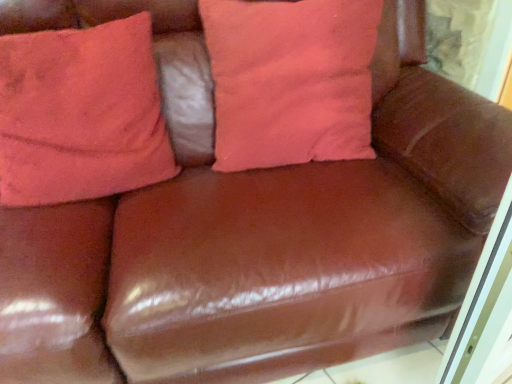
Question: Considering the relative positions of coral fabric pillow at upper left, which is the 1th pillow from left to right, and pink cotton pillow at center, arranged as the first pillow when viewed from the right, in the image provided, is coral fabric pillow at upper left, which is the 1th pillow from left to right, behind pink cotton pillow at center, arranged as the first pillow when viewed from the right,?

Choices:
 (A) no
 (B) yes

Answer: (A)

Question: From the image's perspective, is coral fabric pillow at upper left, marked as the 2th pillow in a right-to-left arrangement, over pink cotton pillow at center, arranged as the first pillow when viewed from the right?

Choices:
 (A) yes
 (B) no

Answer: (B)

Question: From the image's perspective, would you say coral fabric pillow at upper left, marked as the 2th pillow in a right-to-left arrangement, is shown under pink cotton pillow at center, arranged as the first pillow when viewed from the right?

Choices:
 (A) no
 (B) yes

Answer: (B)

Question: Is coral fabric pillow at upper left, which is the 1th pillow from left to right, turned away from pink cotton pillow at center, arranged as the first pillow when viewed from the right?

Choices:
 (A) yes
 (B) no

Answer: (B)

Question: Does coral fabric pillow at upper left, which is the 1th pillow from left to right, have a greater width compared to pink cotton pillow at center, arranged as the first pillow when viewed from the right?

Choices:
 (A) yes
 (B) no

Answer: (B)

Question: Considering the relative sizes of coral fabric pillow at upper left, which is the 1th pillow from left to right, and pink cotton pillow at center, the 2th pillow in the left-to-right sequence, in the image provided, is coral fabric pillow at upper left, which is the 1th pillow from left to right, thinner than pink cotton pillow at center, the 2th pillow in the left-to-right sequence,?

Choices:
 (A) no
 (B) yes

Answer: (B)

Question: Can you confirm if pink cotton pillow at center, arranged as the first pillow when viewed from the right, is smaller than coral fabric pillow at upper left, marked as the 2th pillow in a right-to-left arrangement?

Choices:
 (A) yes
 (B) no

Answer: (B)

Question: Considering the relative sizes of pink cotton pillow at center, the 2th pillow in the left-to-right sequence, and coral fabric pillow at upper left, marked as the 2th pillow in a right-to-left arrangement, in the image provided, is pink cotton pillow at center, the 2th pillow in the left-to-right sequence, bigger than coral fabric pillow at upper left, marked as the 2th pillow in a right-to-left arrangement,?

Choices:
 (A) yes
 (B) no

Answer: (A)

Question: From a real-world perspective, is pink cotton pillow at center, arranged as the first pillow when viewed from the right, physically below coral fabric pillow at upper left, marked as the 2th pillow in a right-to-left arrangement?

Choices:
 (A) no
 (B) yes

Answer: (B)

Question: Does pink cotton pillow at center, the 2th pillow in the left-to-right sequence, have a greater width compared to coral fabric pillow at upper left, marked as the 2th pillow in a right-to-left arrangement?

Choices:
 (A) yes
 (B) no

Answer: (A)

Question: Does pink cotton pillow at center, the 2th pillow in the left-to-right sequence, lie behind coral fabric pillow at upper left, which is the 1th pillow from left to right?

Choices:
 (A) yes
 (B) no

Answer: (A)

Question: Does pink cotton pillow at center, the 2th pillow in the left-to-right sequence, turn towards coral fabric pillow at upper left, which is the 1th pillow from left to right?

Choices:
 (A) yes
 (B) no

Answer: (B)

Question: From a real-world perspective, is pink cotton pillow at center, the 2th pillow in the left-to-right sequence, positioned above or below coral fabric pillow at upper left, marked as the 2th pillow in a right-to-left arrangement?

Choices:
 (A) above
 (B) below

Answer: (B)